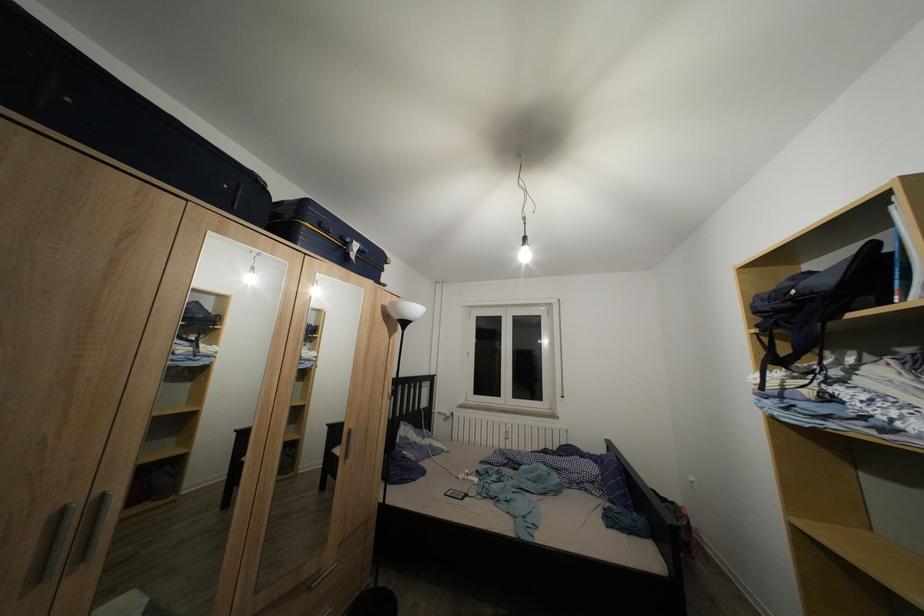
Find the location of `hanging light bulb`. hanging light bulb is located at coordinates (524, 251).